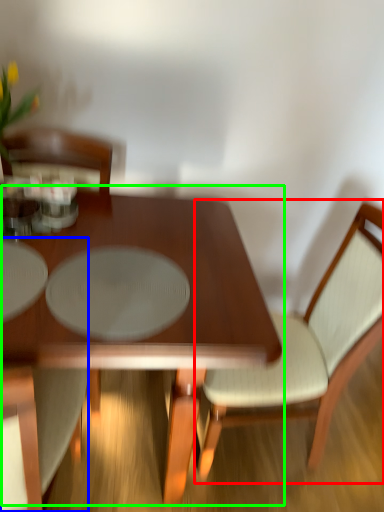
Question: Considering the real-world distances, which object is closest to chair (highlighted by a red box)? chair (highlighted by a blue box) or coffee table (highlighted by a green box).

Choices:
 (A) chair
 (B) coffee table

Answer: (B)